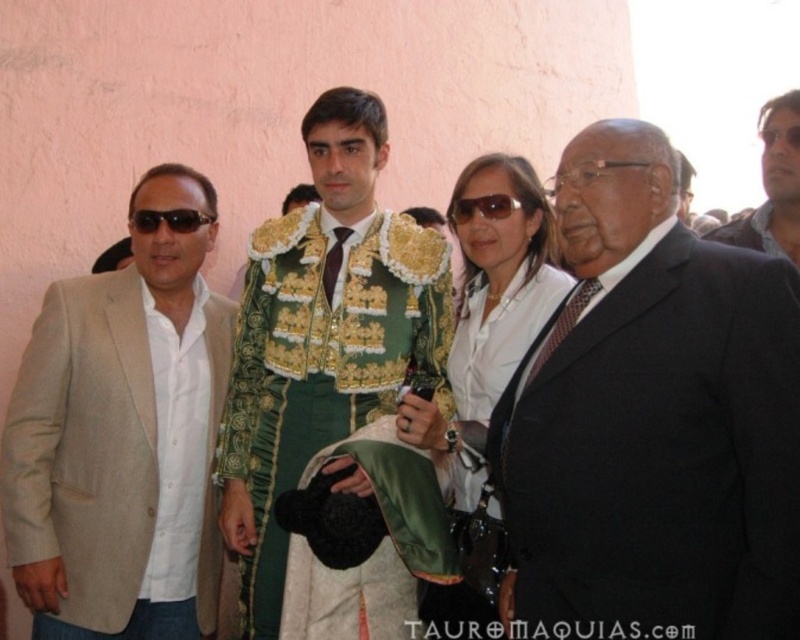
Question: Which of these objects is positioned closest to the matte black sunglasses at upper right?

Choices:
 (A) beige fabric suit at left
 (B) black plastic sunglasses at left
 (C) white satin blouse at center

Answer: (C)

Question: Which point appears farthest from the camera in this image?

Choices:
 (A) (202, 221)
 (B) (302, 636)
 (C) (210, 588)
 (D) (594, 221)

Answer: (A)

Question: Is white satin blouse at center bigger than matte black sunglasses at upper right?

Choices:
 (A) yes
 (B) no

Answer: (A)

Question: Is beige fabric suit at left to the left of green satin jacket at center from the viewer's perspective?

Choices:
 (A) yes
 (B) no

Answer: (A)

Question: Among these points, which one is farthest from the camera?

Choices:
 (A) (162, 168)
 (B) (790, 282)

Answer: (A)

Question: Does beige fabric suit at left lie in front of white satin blouse at center?

Choices:
 (A) no
 (B) yes

Answer: (A)